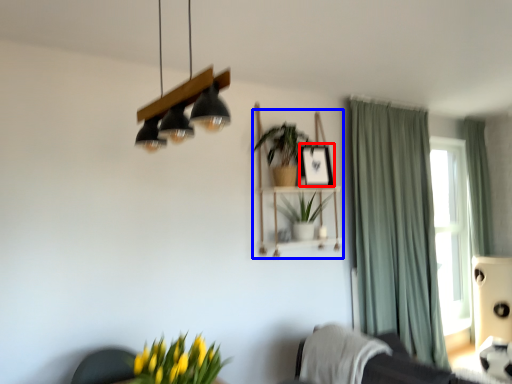
Question: Among these objects, which one is nearest to the camera, picture frame (highlighted by a red box) or shelf (highlighted by a blue box)?

Choices:
 (A) picture frame
 (B) shelf

Answer: (B)